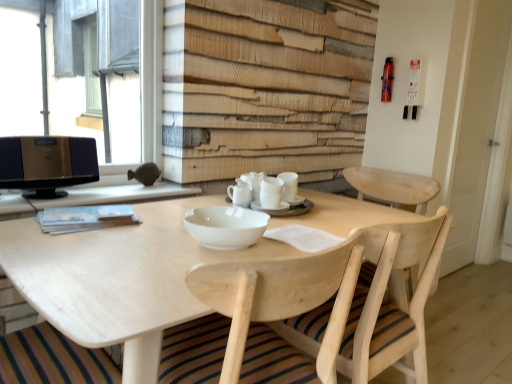
This screenshot has height=384, width=512. In order to click on vacant region to the left of white ceramic cups at center, which is the 2th tableware in left-to-right order in this screenshot , I will do `click(174, 207)`.